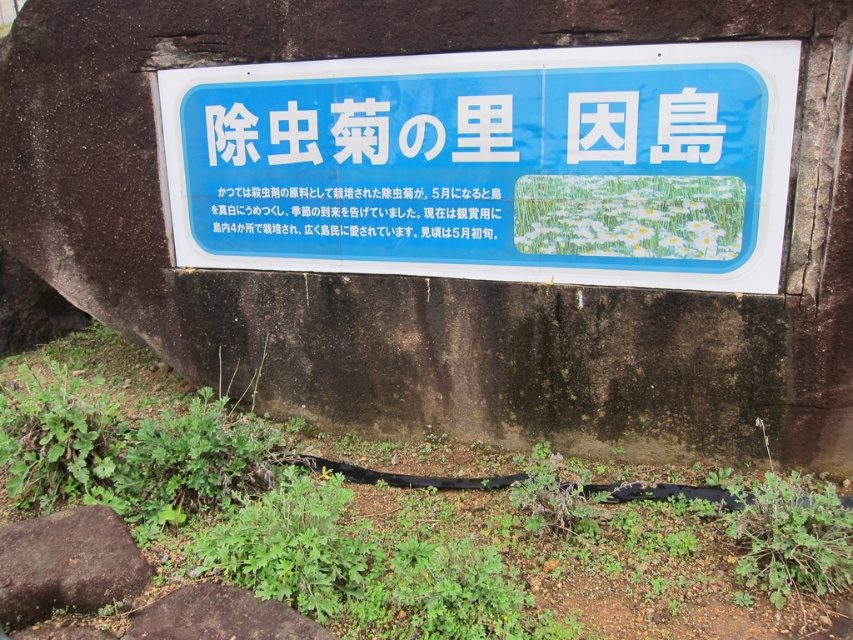
You are standing in front of the signboard on the stone wall. There is a point marked at coordinates (67, 563). What object is located at this point?

The point at coordinates (67, 563) marks the brown rough rock at lower left.

What is located at the coordinates point (491, 164) on the image?

The blue plastic sign at center is located at point (491, 164).